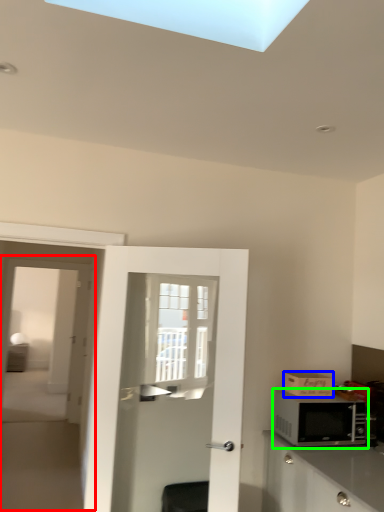
Question: Considering the real-world distances, which object is farthest from screen door (highlighted by a red box)? cardboard box (highlighted by a blue box) or microwave oven (highlighted by a green box)?

Choices:
 (A) cardboard box
 (B) microwave oven

Answer: (A)